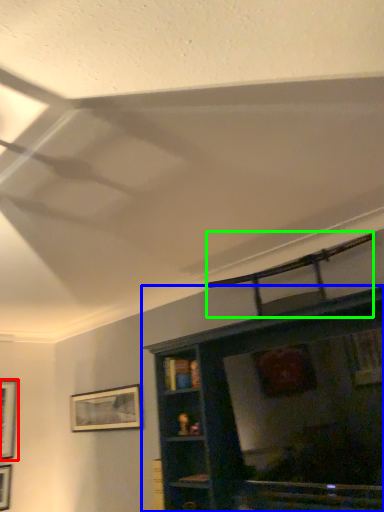
Question: Considering the real-world distances, which object is closest to picture frame (highlighted by a red box)? shelf (highlighted by a blue box) or swivel chair (highlighted by a green box).

Choices:
 (A) shelf
 (B) swivel chair

Answer: (A)